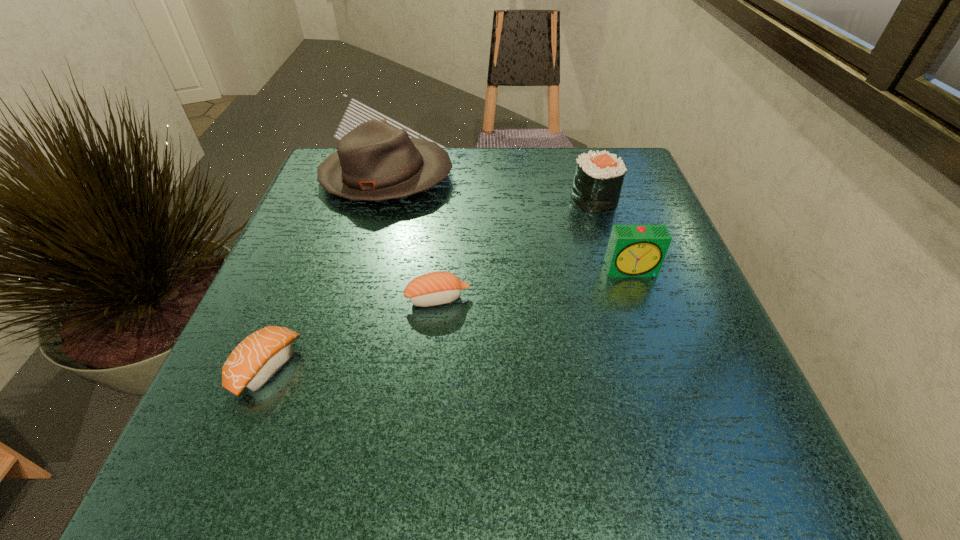
Image resolution: width=960 pixels, height=540 pixels. What are the coordinates of `empty space that is in between the hat and the nearest object` in the screenshot? It's located at (326, 273).

Image resolution: width=960 pixels, height=540 pixels. What are the coordinates of `unoccupied area between the third farthest object and the leftmost sushi` in the screenshot? It's located at (449, 319).

This screenshot has height=540, width=960. I want to click on empty location between the hat and the third nearest object, so click(x=509, y=224).

Find the location of a particular element. This screenshot has height=540, width=960. vacant space in between the alarm clock and the nearest sushi is located at coordinates (449, 319).

Where is `vacant area that lies between the third farthest object and the nearest object`? Image resolution: width=960 pixels, height=540 pixels. vacant area that lies between the third farthest object and the nearest object is located at coordinates (449, 319).

Locate an element on the screen. This screenshot has height=540, width=960. unoccupied position between the leftmost sushi and the hat is located at coordinates (326, 273).

Where is `vacant point located between the hat and the tallest sushi`? vacant point located between the hat and the tallest sushi is located at coordinates (491, 188).

Image resolution: width=960 pixels, height=540 pixels. Identify the location of empty location between the leftmost sushi and the hat. (326, 273).

Select which object appears as the closest to the third farthest object. Please provide its 2D coordinates. Your answer should be formatted as a tuple, i.e. [(x, y)], where the tuple contains the x and y coordinates of a point satisfying the conditions above.

[(598, 179)]

Select which object is the second closest to the tallest sushi. Please provide its 2D coordinates. Your answer should be formatted as a tuple, i.e. [(x, y)], where the tuple contains the x and y coordinates of a point satisfying the conditions above.

[(375, 161)]